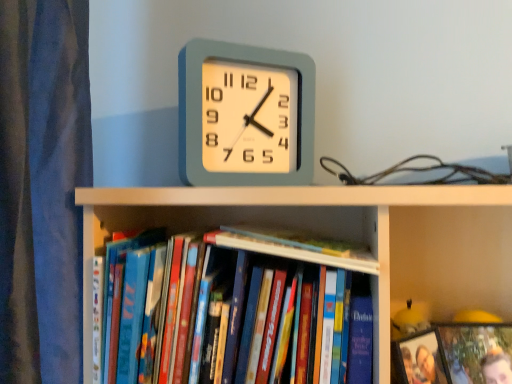
The image size is (512, 384). Describe the element at coordinates (292, 245) in the screenshot. I see `hardcover book at center, positioned as the 2th book in left-to-right order` at that location.

Measure the distance between point (492, 376) and camera.

The distance of point (492, 376) from camera is 25.55 inches.

Find the location of `hardcover book at left`. hardcover book at left is located at coordinates (132, 314).

Is matte plastic photo frame at lower right, the third book when ordered from left to right, inside or outside of hardcover book at left?

matte plastic photo frame at lower right, the third book when ordered from left to right, is not inside hardcover book at left, it's outside.

Between matte plastic photo frame at lower right, which ranks as the first book in right-to-left order, and hardcover book at left, which one has larger size?

Bigger between the two is matte plastic photo frame at lower right, which ranks as the first book in right-to-left order.

Is matte plastic photo frame at lower right, the third book when ordered from left to right, oriented away from hardcover book at left?

matte plastic photo frame at lower right, the third book when ordered from left to right, does not have its back to hardcover book at left.

Which object is further away from the camera, wooden photo frame at lower right or hardcover book at center, which is the second book in right-to-left order?

Positioned behind is hardcover book at center, which is the second book in right-to-left order.

Is wooden photo frame at lower right oriented towards hardcover book at center, which is the second book in right-to-left order?

No, wooden photo frame at lower right does not turn towards hardcover book at center, which is the second book in right-to-left order.

Does wooden photo frame at lower right have a greater height compared to hardcover book at center, positioned as the 2th book in left-to-right order?

Yes, wooden photo frame at lower right is taller than hardcover book at center, positioned as the 2th book in left-to-right order.

In the scene shown: Is wooden photo frame at lower right bigger than hardcover book at center, positioned as the 2th book in left-to-right order?

Actually, wooden photo frame at lower right might be smaller than hardcover book at center, positioned as the 2th book in left-to-right order.

Is wooden photo frame at lower right oriented towards matte plastic photo frame at lower right, the third book when ordered from left to right?

No, wooden photo frame at lower right is not aimed at matte plastic photo frame at lower right, the third book when ordered from left to right.

Considering the relative sizes of wooden photo frame at lower right and matte plastic photo frame at lower right, the third book when ordered from left to right, in the image provided, is wooden photo frame at lower right wider than matte plastic photo frame at lower right, the third book when ordered from left to right,?

Indeed, wooden photo frame at lower right has a greater width compared to matte plastic photo frame at lower right, the third book when ordered from left to right.

Where is `picture frame on the left side of matte plastic photo frame at lower right, the third book when ordered from left to right`? This screenshot has height=384, width=512. picture frame on the left side of matte plastic photo frame at lower right, the third book when ordered from left to right is located at coordinates (421, 359).

From a real-world perspective, relative to matte plastic photo frame at lower right, the third book when ordered from left to right, is wooden photo frame at lower right vertically above or below?

In terms of real-world spatial position, wooden photo frame at lower right is above matte plastic photo frame at lower right, the third book when ordered from left to right.

From the image's perspective, which object appears higher, hardcover books at center, marked as the 1th book in a left-to-right arrangement, or matte plastic clock at center?

matte plastic clock at center.

Is hardcover books at center, which is counted as the third book, starting from the right, far away from matte plastic clock at center?

They are positioned close to each other.

Is hardcover books at center, which is counted as the third book, starting from the right, smaller than matte plastic clock at center?

Incorrect, hardcover books at center, which is counted as the third book, starting from the right, is not smaller in size than matte plastic clock at center.

Considering the relative sizes of hardcover books at center, which is counted as the third book, starting from the right, and matte plastic clock at center in the image provided, is hardcover books at center, which is counted as the third book, starting from the right, wider than matte plastic clock at center?

Yes.

From a real-world perspective, which object rests below the other?

wooden photo frame at lower right.

Is point (257, 364) positioned in front of point (404, 371)?

No, it is not.

Image resolution: width=512 pixels, height=384 pixels. What are the coordinates of `picture frame lying below the hardcover books at center, which is counted as the third book, starting from the right (from the image's perspective)` in the screenshot? It's located at (421, 359).

Do you think matte plastic clock at center is within wooden photo frame at lower right, or outside of it?

matte plastic clock at center is not inside wooden photo frame at lower right, it's outside.

Who is bigger, matte plastic clock at center or wooden photo frame at lower right?

matte plastic clock at center.

Which is in front, matte plastic clock at center or wooden photo frame at lower right?

wooden photo frame at lower right is more forward.

From the image's perspective, would you say matte plastic clock at center is shown under wooden photo frame at lower right?

Incorrect, from the image's perspective, matte plastic clock at center is higher than wooden photo frame at lower right.

Between point (133, 353) and point (333, 248), which one is positioned in front?

Positioned in front is point (133, 353).

From the image's perspective, which one is positioned lower, hardcover book at left or hardcover book at center, positioned as the 2th book in left-to-right order?

From the image's view, hardcover book at left is below.

Are hardcover book at left and hardcover book at center, positioned as the 2th book in left-to-right order, far apart?

Actually, hardcover book at left and hardcover book at center, positioned as the 2th book in left-to-right order, are a little close together.

Considering the sizes of objects hardcover book at left and hardcover book at center, which is the second book in right-to-left order, in the image provided, who is shorter, hardcover book at left or hardcover book at center, which is the second book in right-to-left order,?

With less height is hardcover book at center, which is the second book in right-to-left order.

The image size is (512, 384). I want to click on book behind the hardcover book at left, so click(x=455, y=355).

Where is `picture frame in front of the hardcover book at center, positioned as the 2th book in left-to-right order`? picture frame in front of the hardcover book at center, positioned as the 2th book in left-to-right order is located at coordinates (421, 359).

When comparing their distances from matte plastic photo frame at lower right, the third book when ordered from left to right, does matte plastic clock at center or hardcover book at left seem further?

hardcover book at left.

Considering their positions, is hardcover book at center, which is the second book in right-to-left order, positioned further to wooden photo frame at lower right than hardcover book at left?

hardcover book at left lies further to wooden photo frame at lower right than the other object.

When comparing their distances from hardcover book at center, which is the second book in right-to-left order, does hardcover book at left or matte plastic clock at center seem closer?

Among the two, matte plastic clock at center is located nearer to hardcover book at center, which is the second book in right-to-left order.

From the image, which object appears to be farther from hardcover books at center, which is counted as the third book, starting from the right, wooden photo frame at lower right or hardcover book at left?

wooden photo frame at lower right.

Looking at this image, looking at the image, which one is located further to hardcover books at center, marked as the 1th book in a left-to-right arrangement, hardcover book at center, which is the second book in right-to-left order, or hardcover book at left?

hardcover book at left.

Based on their spatial positions, is matte plastic clock at center or hardcover book at center, which is the second book in right-to-left order, closer to wooden photo frame at lower right?

The object closer to wooden photo frame at lower right is hardcover book at center, which is the second book in right-to-left order.

From the picture: From the image, which object appears to be nearer to hardcover book at left, matte plastic clock at center or matte plastic photo frame at lower right, the third book when ordered from left to right?

matte plastic clock at center.

From the image, which object appears to be farther from wooden photo frame at lower right, matte plastic photo frame at lower right, which ranks as the first book in right-to-left order, or hardcover books at center, marked as the 1th book in a left-to-right arrangement?

hardcover books at center, marked as the 1th book in a left-to-right arrangement, is positioned further to the anchor wooden photo frame at lower right.

Find the location of `picture frame between hardcover books at center, which is counted as the third book, starting from the right, and matte plastic photo frame at lower right, which ranks as the first book in right-to-left order`. picture frame between hardcover books at center, which is counted as the third book, starting from the right, and matte plastic photo frame at lower right, which ranks as the first book in right-to-left order is located at coordinates (421, 359).

I want to click on book between matte plastic clock at center and matte plastic photo frame at lower right, the third book when ordered from left to right, so [292, 245].

Identify the location of book between matte plastic clock at center and hardcover books at center, marked as the 1th book in a left-to-right arrangement, vertically. This screenshot has width=512, height=384. (292, 245).

Locate an element on the screen. wall clock between hardcover book at left and matte plastic photo frame at lower right, the third book when ordered from left to right, in the horizontal direction is located at coordinates (245, 115).